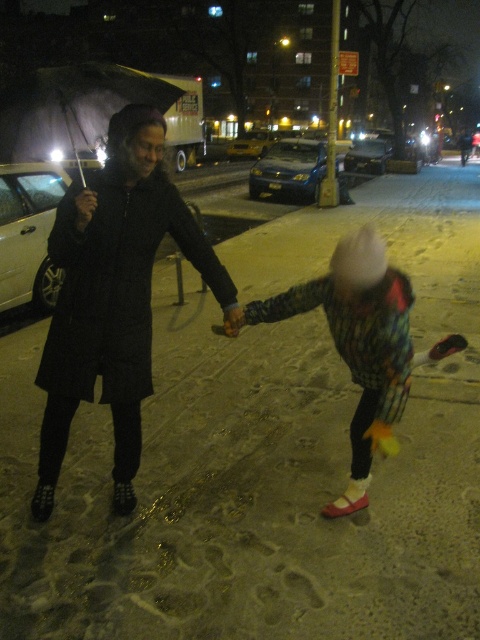
Does transparent plastic umbrella at upper left have a lesser height compared to metallic blue sedan at center?

Correct, transparent plastic umbrella at upper left is not as tall as metallic blue sedan at center.

Describe the element at coordinates (72, 109) in the screenshot. Image resolution: width=480 pixels, height=640 pixels. I see `transparent plastic umbrella at upper left` at that location.

What do you see at coordinates (72, 109) in the screenshot? This screenshot has height=640, width=480. I see `transparent plastic umbrella at upper left` at bounding box center [72, 109].

Locate an element on the screen. transparent plastic umbrella at upper left is located at coordinates (72, 109).

Between point (131, 170) and point (24, 260), which one is positioned in front?

Point (131, 170) is in front.

Does black textured coat at left lie behind white matte car at left?

No, black textured coat at left is closer to the viewer.

Which is in front, point (156, 198) or point (27, 250)?

Positioned in front is point (156, 198).

The height and width of the screenshot is (640, 480). I want to click on black textured coat at left, so click(x=113, y=296).

The height and width of the screenshot is (640, 480). Find the location of `blue metallic hatchback at center`. blue metallic hatchback at center is located at coordinates (289, 170).

Is point (321, 154) positioned in front of point (247, 148)?

Yes, it is in front of point (247, 148).

Locate an element on the screen. The width and height of the screenshot is (480, 640). blue metallic hatchback at center is located at coordinates (289, 170).